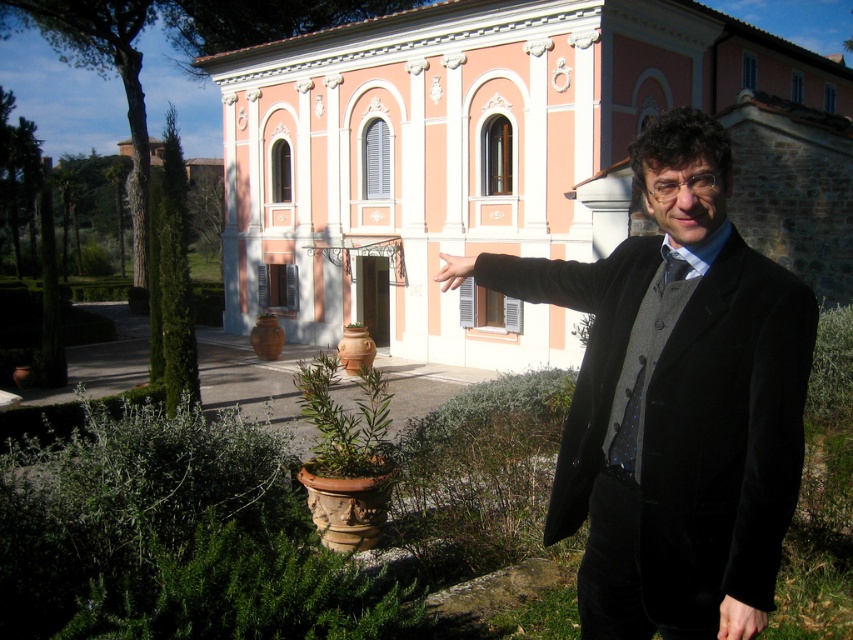
From the picture: You are a fashion designer observing the scene and notice the velvet black coat at center. Can you determine its exact position relative to the other elements in the scene?

The velvet black coat at center is located at point coordinates of 0.625 on the x axis and 0.794 on the y axis.

You are a fashion designer observing the man in the scene. You notice the velvet black coat at center and the smooth skin hand at lower right. Which item is positioned higher in the image?

The velvet black coat at center is located above the smooth skin hand at lower right, so the velvet black coat at center is positioned higher in the image.